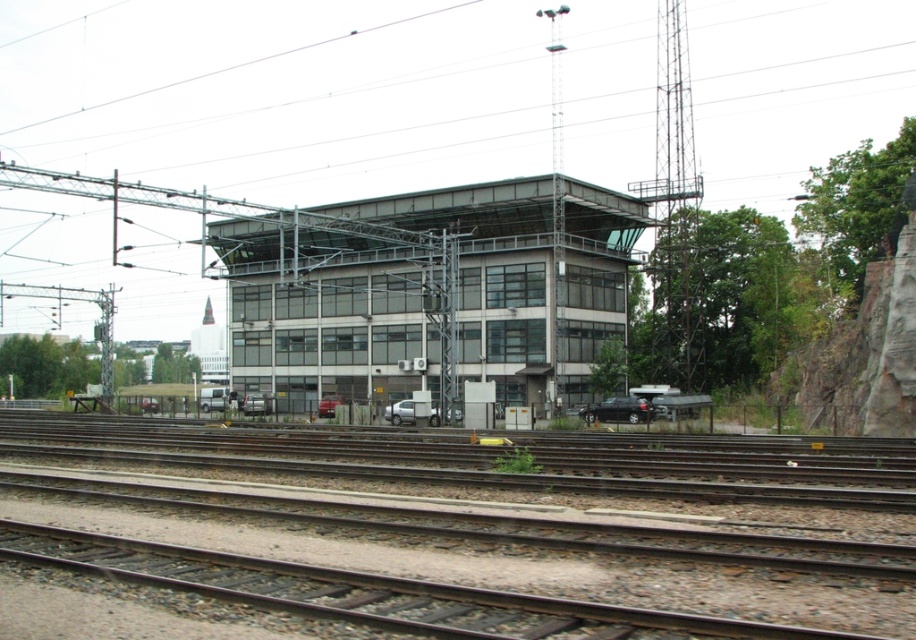
Can you confirm if metallic train tracks at center is smaller than glassy steel building at center?

Indeed, metallic train tracks at center has a smaller size compared to glassy steel building at center.

Is metallic train tracks at center wider than glassy steel building at center?

In fact, metallic train tracks at center might be narrower than glassy steel building at center.

Identify the location of metallic train tracks at center. (476, 525).

Locate an element on the screen. This screenshot has width=916, height=640. metallic train tracks at center is located at coordinates (476, 525).